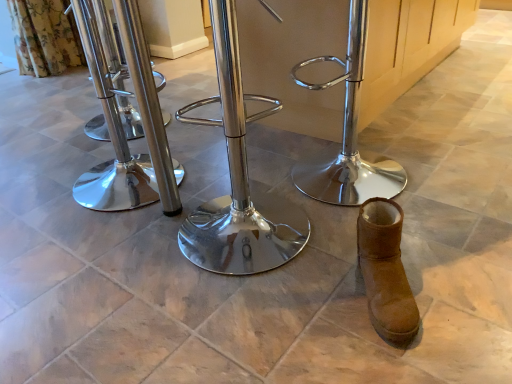
Find the location of a particular element. vacant region to the left of polished metal swivel chair at center, which appears as the 2th swivel chair when viewed from the left is located at coordinates (120, 259).